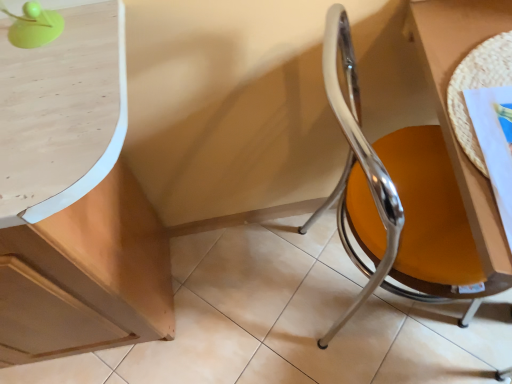
Locate an element on the screen. The width and height of the screenshot is (512, 384). vacant area that lies between light brown wood cabinet at left and chrome/yellow seat at right is located at coordinates (242, 306).